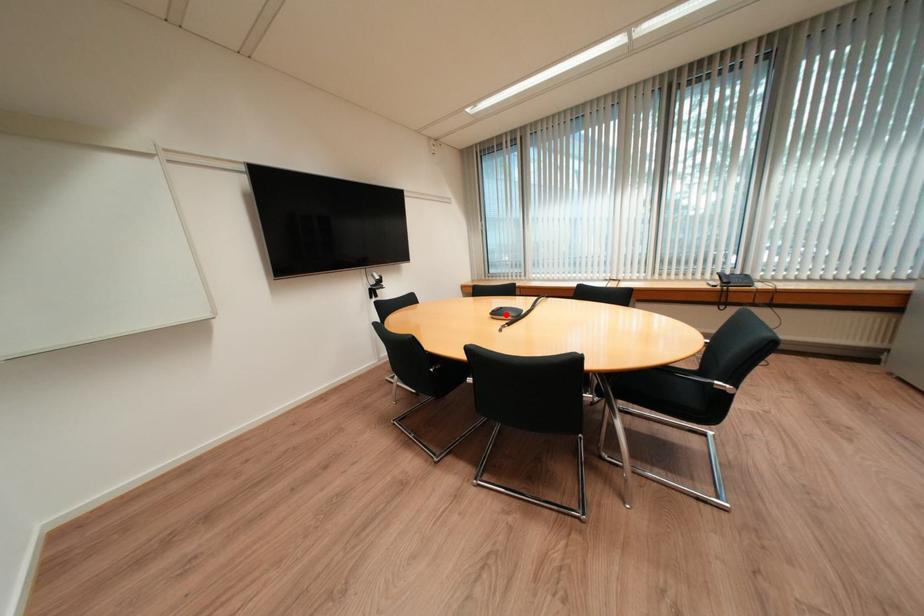
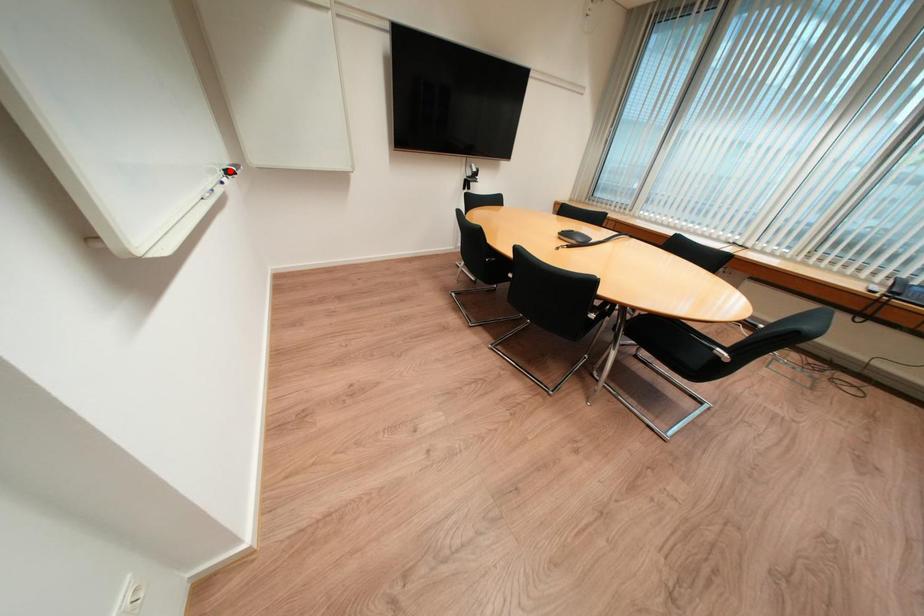
I am providing you with two images of the same scene from different viewpoints. A red point is marked on the first image and another point is marked on the second image. Is the marked point in image1 the same physical position as the marked point in image2?

No